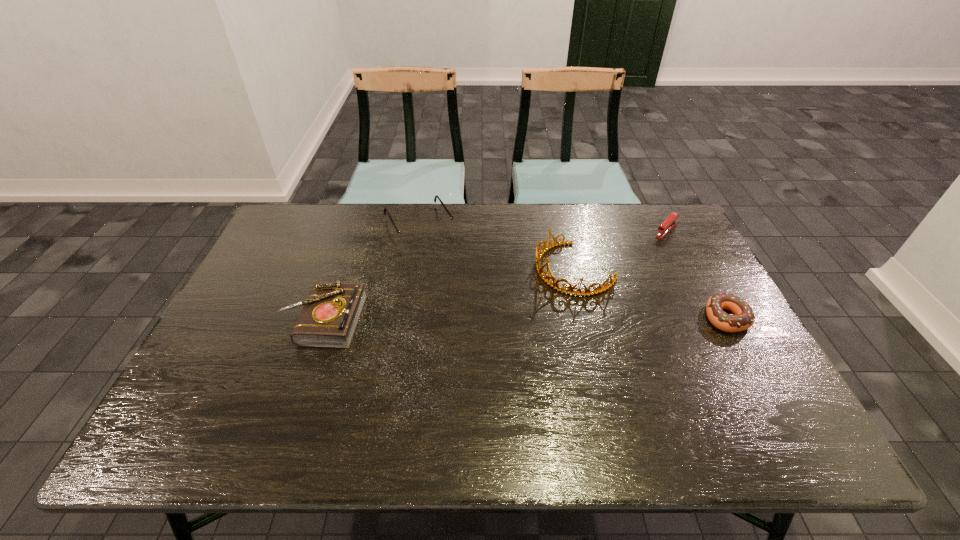
The height and width of the screenshot is (540, 960). In order to click on diary in this screenshot , I will do `click(329, 318)`.

In order to click on doughnut in this screenshot , I will do `click(744, 317)`.

Identify the location of the third object from right to left. This screenshot has width=960, height=540. (539, 254).

Locate an element on the screen. This screenshot has height=540, width=960. tiara is located at coordinates (539, 254).

This screenshot has height=540, width=960. In order to click on stapler in this screenshot , I will do `click(668, 224)`.

Locate an element on the screen. This screenshot has width=960, height=540. spectacles is located at coordinates (410, 235).

Locate an element on the screen. vacant area located 0.310m on the back of the diary is located at coordinates coord(355,228).

Identify the location of vacant space located 0.260m on the back of the doughnut. (684, 242).

Where is `blank space located 0.100m on the front-facing side of the tiara`? This screenshot has height=540, width=960. blank space located 0.100m on the front-facing side of the tiara is located at coordinates (517, 299).

Find the location of `vacant space located on the front-facing side of the tiara`. vacant space located on the front-facing side of the tiara is located at coordinates (485, 316).